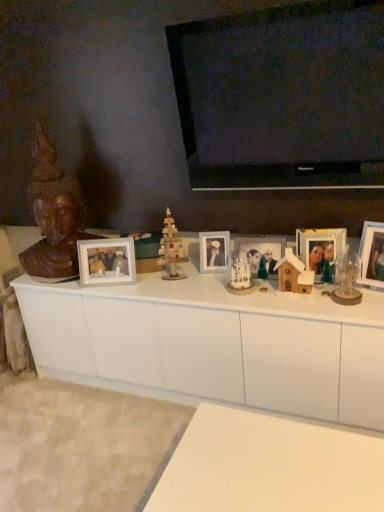
The width and height of the screenshot is (384, 512). What are the coordinates of `free location to the left of wooden christmas tree at center, arranged as the first toy when viewed from the left` in the screenshot? It's located at (142, 284).